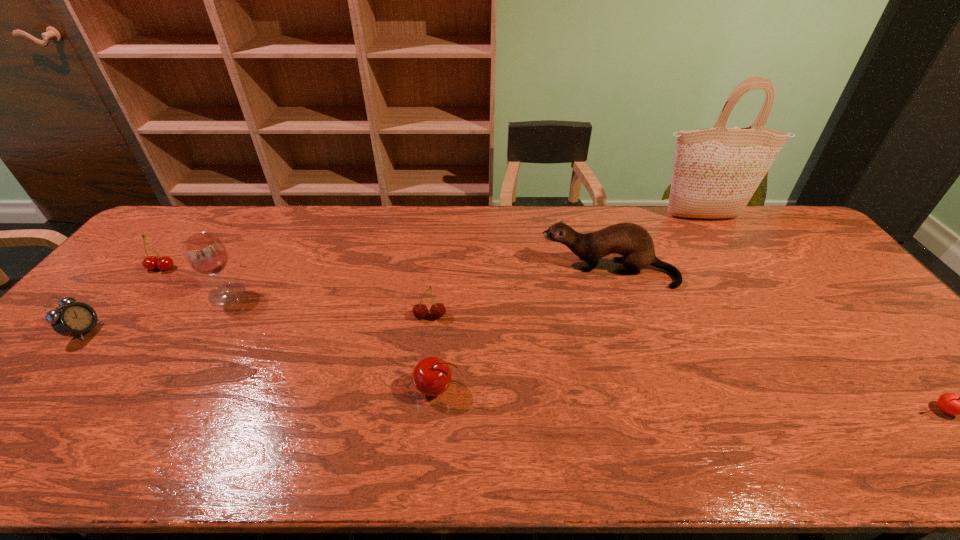
You are a GUI agent. You are given a task and a screenshot of the screen. Output one action in this format:
    pyautogui.click(x=<x>, y=<y>)
    Task: Click on the empty space that is in between the shopping bag and the third nearest cherry
    The image size is (960, 540).
    Given the screenshot: What is the action you would take?
    pyautogui.click(x=565, y=267)

Locate which object ranks seventh in proximity to the third object from left to right. Please provide its 2D coordinates. Your answer should be formatted as a tuple, i.e. [(x, y)], where the tuple contains the x and y coordinates of a point satisfying the conditions above.

[(950, 403)]

What are the coordinates of `object that is the fifth closest to the second farthest cherry` in the screenshot? It's located at (716, 171).

Choose which cherry is the third nearest neighbor to the leftmost cherry. Please provide its 2D coordinates. Your answer should be formatted as a tuple, i.e. [(x, y)], where the tuple contains the x and y coordinates of a point satisfying the conditions above.

[(950, 403)]

Identify which cherry is the nearest to the rightmost cherry. Please provide its 2D coordinates. Your answer should be formatted as a tuple, i.e. [(x, y)], where the tuple contains the x and y coordinates of a point satisfying the conditions above.

[(432, 376)]

Where is `free point that satisfies the following two spatial constraints: 1. with the stems of the leftmost cherry pointing upwards; 2. on the left side of the wineglass`? The height and width of the screenshot is (540, 960). free point that satisfies the following two spatial constraints: 1. with the stems of the leftmost cherry pointing upwards; 2. on the left side of the wineglass is located at coordinates (140, 294).

Identify the location of free spot that satisfies the following two spatial constraints: 1. on the back side of the farthest object; 2. on the right side of the wineglass. (275, 217).

Locate an element on the screen. The height and width of the screenshot is (540, 960). vacant area in the image that satisfies the following two spatial constraints: 1. at the face of the sixth shortest object; 2. on the surface of the second farthest cherry is located at coordinates (624, 316).